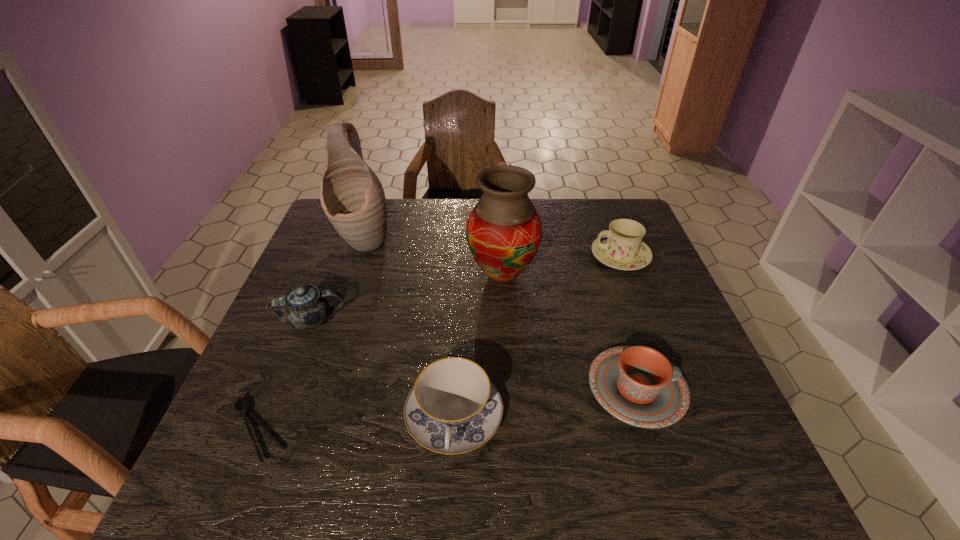
Where is `vacant area situated 0.390m from the spout of the leftmost chinaware`? vacant area situated 0.390m from the spout of the leftmost chinaware is located at coordinates (502, 321).

What are the coordinates of `free space located on the handle side of the farthest chinaware` in the screenshot? It's located at (550, 256).

The image size is (960, 540). In order to click on blank area located on the handle side of the farthest chinaware in this screenshot , I will do `click(530, 256)`.

Locate an element on the screen. This screenshot has width=960, height=540. vacant space situated on the handle side of the farthest chinaware is located at coordinates (x=546, y=256).

Image resolution: width=960 pixels, height=540 pixels. In order to click on vacant area located with the handle on the side of the second chinaware from left to right in this screenshot , I will do `click(450, 493)`.

You are a GUI agent. You are given a task and a screenshot of the screen. Output one action in this format:
    pyautogui.click(x=<x>, y=<y>)
    Task: Click on the vacant space situated 0.050m on the handle side of the shortest chinaware
    
    Given the screenshot: What is the action you would take?
    pyautogui.click(x=708, y=389)

Where is `free point located 0.150m on the back of the tongs`? The width and height of the screenshot is (960, 540). free point located 0.150m on the back of the tongs is located at coordinates pos(293,344).

Locate an element on the screen. The width and height of the screenshot is (960, 540). pitcher that is at the far edge is located at coordinates (352, 197).

At what (x,y) coordinates should I click in order to perform the action: click on chinaware situated at the far edge. Please return your answer as a coordinate pair (x, y). The image size is (960, 540). Looking at the image, I should click on (621, 247).

Find the location of `chinaware that is at the near edge`. chinaware that is at the near edge is located at coordinates (453, 408).